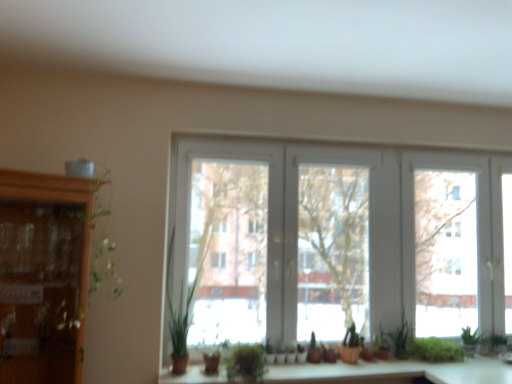
Question: Is matte wood counter top at center wider than green leafy plant at center, which ranks as the sixth plant in right-to-left order?

Choices:
 (A) no
 (B) yes

Answer: (B)

Question: From a real-world perspective, does matte wood counter top at center stand above green leafy plant at center, the first plant in the left-to-right sequence?

Choices:
 (A) no
 (B) yes

Answer: (A)

Question: From the image's perspective, is matte wood counter top at center under green leafy plant at center, the first plant in the left-to-right sequence?

Choices:
 (A) no
 (B) yes

Answer: (B)

Question: Can we say matte wood counter top at center lies outside green leafy plant at center, the first plant in the left-to-right sequence?

Choices:
 (A) yes
 (B) no

Answer: (A)

Question: Is there a large distance between matte wood counter top at center and green leafy plant at center, which ranks as the sixth plant in right-to-left order?

Choices:
 (A) no
 (B) yes

Answer: (A)

Question: Considering the relative positions of green matte plant at center, positioned as the third plant in left-to-right order, and matte wood counter top at center in the image provided, is green matte plant at center, positioned as the third plant in left-to-right order, to the left or to the right of matte wood counter top at center?

Choices:
 (A) left
 (B) right

Answer: (B)

Question: Is point (329, 350) closer or farther from the camera than point (166, 374)?

Choices:
 (A) closer
 (B) farther

Answer: (B)

Question: Relative to matte wood counter top at center, is green matte plant at center, positioned as the third plant in left-to-right order, in front or behind?

Choices:
 (A) behind
 (B) front

Answer: (A)

Question: From the image's perspective, is green matte plant at center, which appears as the 4th plant when viewed from the right, positioned above or below matte wood counter top at center?

Choices:
 (A) below
 (B) above

Answer: (B)

Question: Considering the positions of green leafy plant at center, which ranks as the sixth plant in right-to-left order, and green matte plant at lower right, acting as the 4th plant starting from the left, in the image, is green leafy plant at center, which ranks as the sixth plant in right-to-left order, taller or shorter than green matte plant at lower right, acting as the 4th plant starting from the left,?

Choices:
 (A) short
 (B) tall

Answer: (B)

Question: Visually, is green leafy plant at center, which ranks as the sixth plant in right-to-left order, positioned to the left or to the right of green matte plant at lower right, acting as the 4th plant starting from the left?

Choices:
 (A) right
 (B) left

Answer: (B)

Question: Is green leafy plant at center, which ranks as the sixth plant in right-to-left order, spatially inside green matte plant at lower right, acting as the 4th plant starting from the left, or outside of it?

Choices:
 (A) outside
 (B) inside

Answer: (A)

Question: Considering the positions of green leafy plant at center, the first plant in the left-to-right sequence, and green matte plant at lower right, which appears as the 3th plant when viewed from the right, in the image, is green leafy plant at center, the first plant in the left-to-right sequence, bigger or smaller than green matte plant at lower right, which appears as the 3th plant when viewed from the right,?

Choices:
 (A) small
 (B) big

Answer: (B)

Question: In the image, is wooden cabinet at left positioned in front of or behind white plastic window at center?

Choices:
 (A) front
 (B) behind

Answer: (A)

Question: Does point tap(53, 347) appear closer or farther from the camera than point tap(421, 249)?

Choices:
 (A) farther
 (B) closer

Answer: (B)